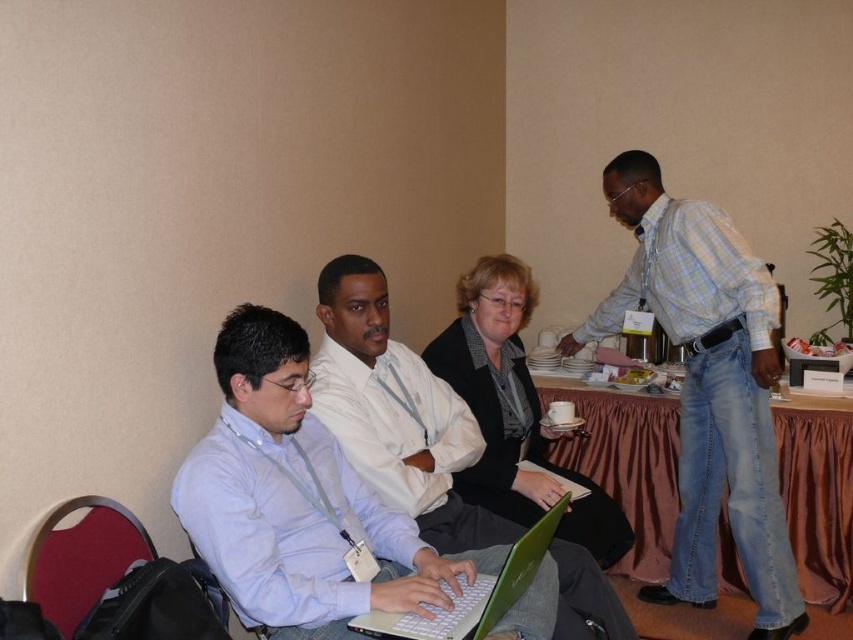
Question: Which object is farther from the camera taking this photo?

Choices:
 (A) velvet red chair at lower left
 (B) matte white shirt at center
 (C) brown fabric table at center

Answer: (C)

Question: Observing the image, what is the correct spatial positioning of brown fabric table at center in reference to green matte laptop at center?

Choices:
 (A) below
 (B) above

Answer: (A)

Question: Does velvet red chair at lower left appear over green matte laptop at center?

Choices:
 (A) yes
 (B) no

Answer: (A)

Question: Based on their relative distances, which object is farther from the green matte laptop at center?

Choices:
 (A) white shirt at center
 (B) brown fabric table at center

Answer: (B)

Question: Which point is farther to the camera?

Choices:
 (A) (351, 314)
 (B) (817, 410)

Answer: (B)

Question: Can you confirm if light blue plaid shirt at right is smaller than velvet red chair at lower left?

Choices:
 (A) yes
 (B) no

Answer: (B)